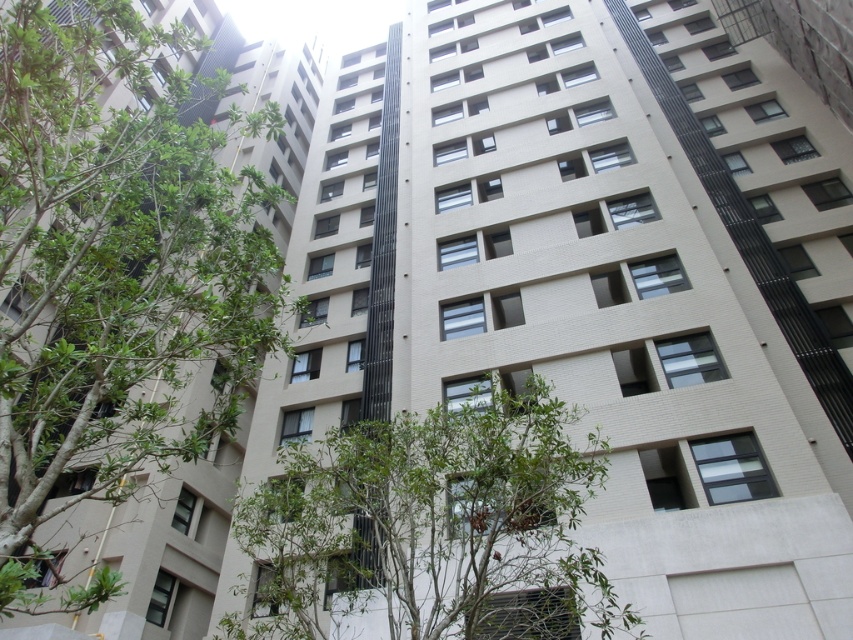
Question: Can you confirm if green leafy tree at left is smaller than green leafy tree at lower center?

Choices:
 (A) no
 (B) yes

Answer: (A)

Question: Does green leafy tree at left have a greater width compared to green leafy tree at lower center?

Choices:
 (A) no
 (B) yes

Answer: (B)

Question: Observing the image, what is the correct spatial positioning of green leafy tree at left in reference to green leafy tree at lower center?

Choices:
 (A) above
 (B) below

Answer: (A)

Question: Among these objects, which one is nearest to the camera?

Choices:
 (A) green leafy tree at left
 (B) green leafy tree at lower center

Answer: (A)

Question: Which point appears closest to the camera in this image?

Choices:
 (A) (93, 186)
 (B) (474, 596)

Answer: (A)